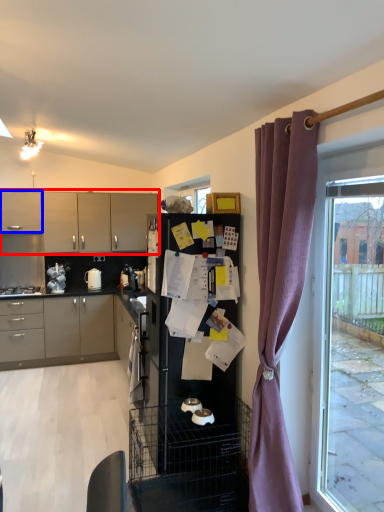
Question: Which point is further to the camera, cabinetry (highlighted by a red box) or cabinetry (highlighted by a blue box)?

Choices:
 (A) cabinetry
 (B) cabinetry

Answer: (A)